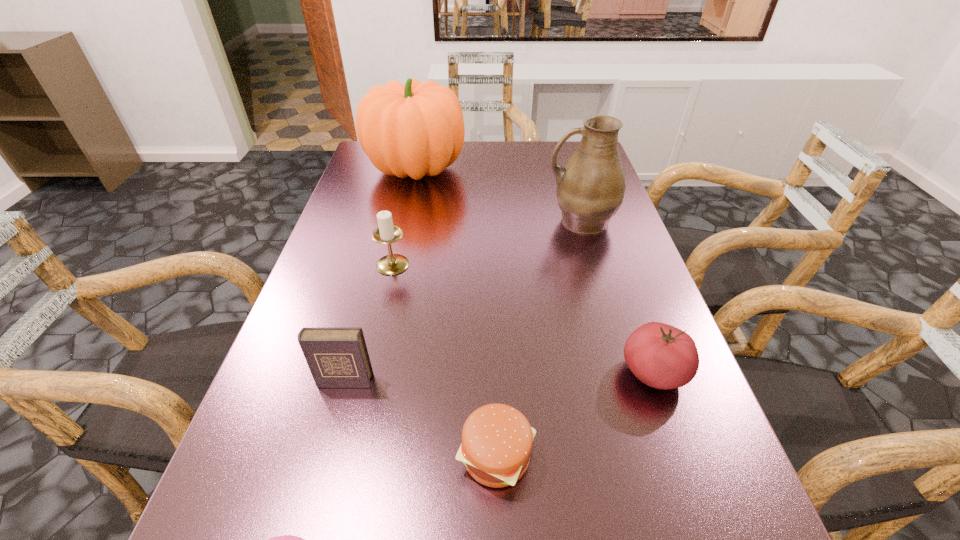
What are the coordinates of `vacant space that's between the sixth nearest object and the diary` in the screenshot? It's located at (463, 301).

Identify the location of vacant area between the second farthest object and the fifth nearest object. This screenshot has height=540, width=960. (487, 242).

Point out which object is positioned as the fourth nearest to the second farthest object. Please provide its 2D coordinates. Your answer should be formatted as a tuple, i.e. [(x, y)], where the tuple contains the x and y coordinates of a point satisfying the conditions above.

[(497, 439)]

Choose which object is the fourth nearest neighbor to the pumpkin. Please provide its 2D coordinates. Your answer should be formatted as a tuple, i.e. [(x, y)], where the tuple contains the x and y coordinates of a point satisfying the conditions above.

[(661, 356)]

This screenshot has width=960, height=540. Find the location of `free spot that satisfies the following two spatial constraints: 1. on the front side of the third farthest object; 2. on the left side of the tomato`. free spot that satisfies the following two spatial constraints: 1. on the front side of the third farthest object; 2. on the left side of the tomato is located at coordinates (369, 373).